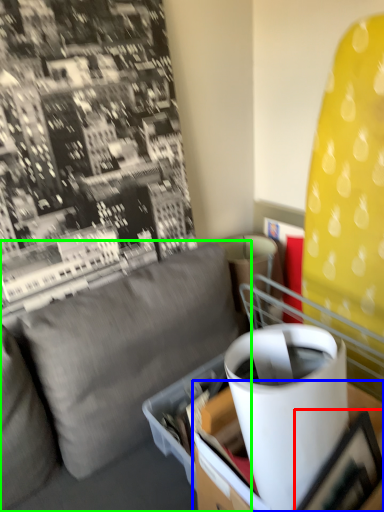
Question: Which object is positioned closest to picture frame (highlighted by a red box)? Select from table (highlighted by a blue box) and studio couch (highlighted by a green box).

Choices:
 (A) table
 (B) studio couch

Answer: (A)